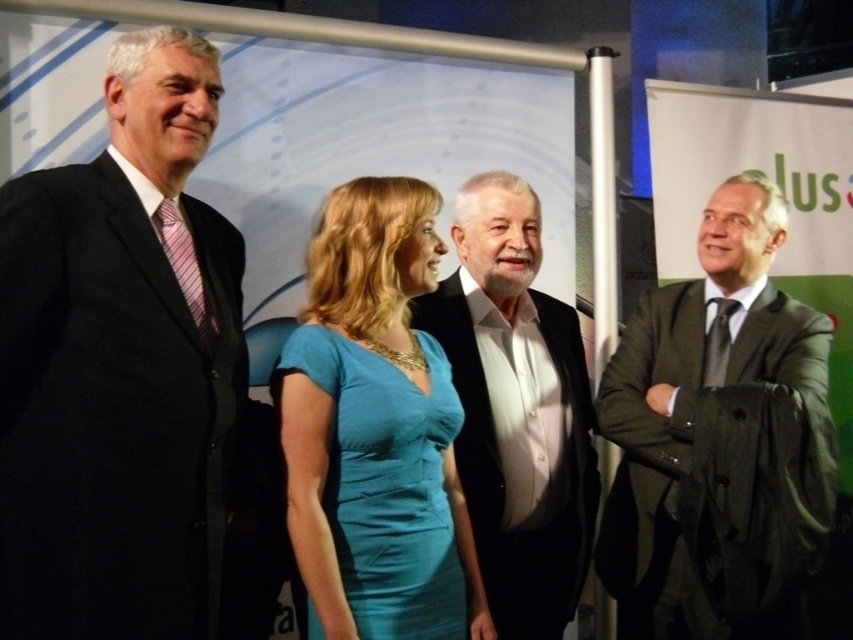
Question: Can you confirm if black suit at left is thinner than white matte suit at center?

Choices:
 (A) yes
 (B) no

Answer: (A)

Question: Which point is farther to the camera?

Choices:
 (A) (358, 440)
 (B) (538, 624)

Answer: (B)

Question: Can you confirm if black suit at left is positioned to the left of dark gray suit at right?

Choices:
 (A) no
 (B) yes

Answer: (B)

Question: Is dark gray suit at right further to the viewer compared to teal satin dress at center?

Choices:
 (A) no
 (B) yes

Answer: (B)

Question: Which point is closer to the camera?

Choices:
 (A) white matte suit at center
 (B) teal satin dress at center

Answer: (B)

Question: Among these objects, which one is farthest from the camera?

Choices:
 (A) white matte suit at center
 (B) black suit at left
 (C) teal satin dress at center

Answer: (A)